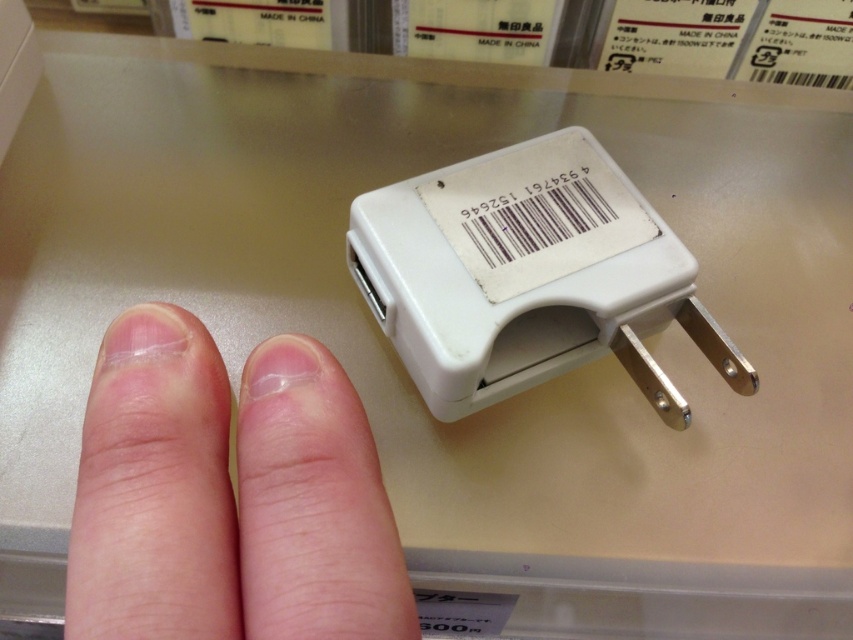
Which of these two, pink flesh-toned fingers at center or white plastic plug at center, stands taller?

white plastic plug at center

Where is `pink flesh-toned fingers at center`? Image resolution: width=853 pixels, height=640 pixels. pink flesh-toned fingers at center is located at coordinates (228, 496).